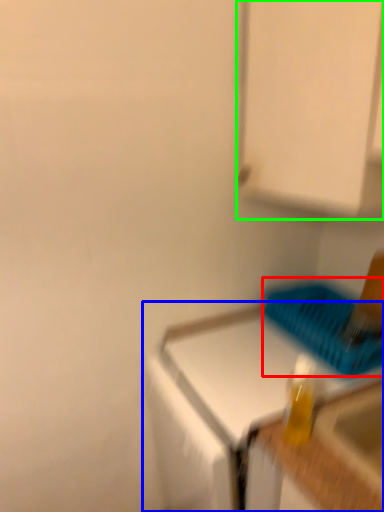
Question: Considering the real-world distances, which object is closest to basket (highlighted by a red box)? countertop (highlighted by a blue box) or cabinetry (highlighted by a green box).

Choices:
 (A) countertop
 (B) cabinetry

Answer: (A)